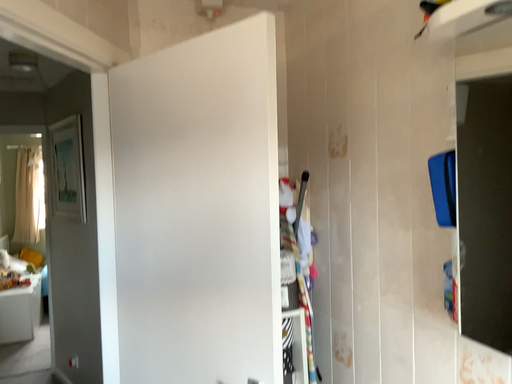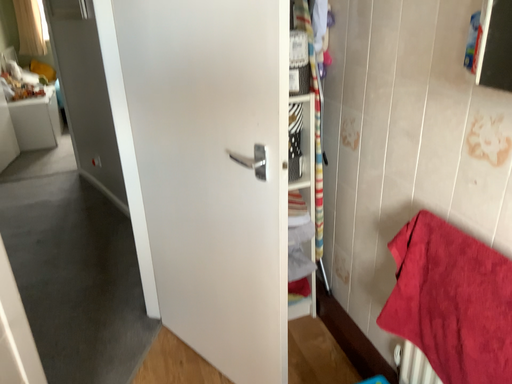
Question: Which way did the camera rotate in the video?

Choices:
 (A) rotated upward
 (B) rotated downward

Answer: (B)